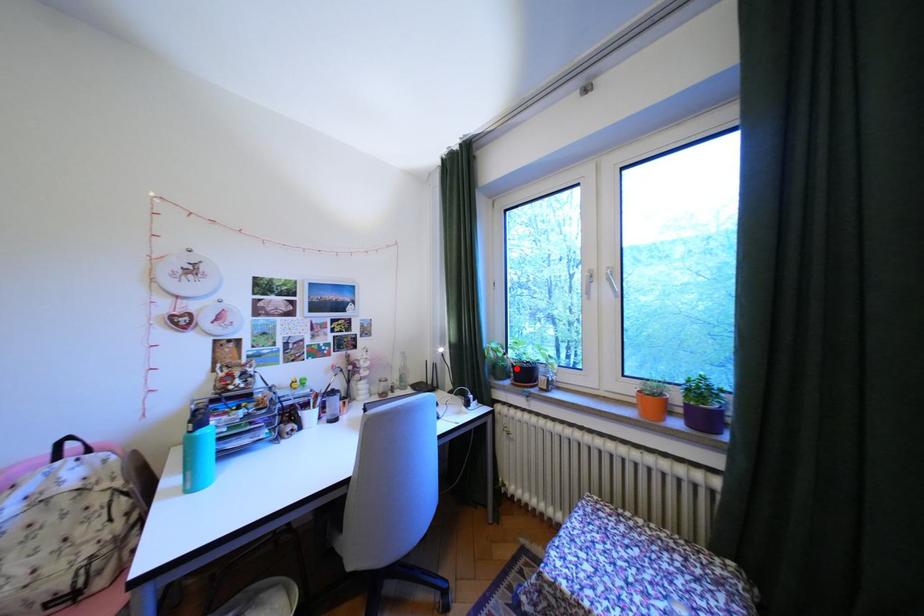
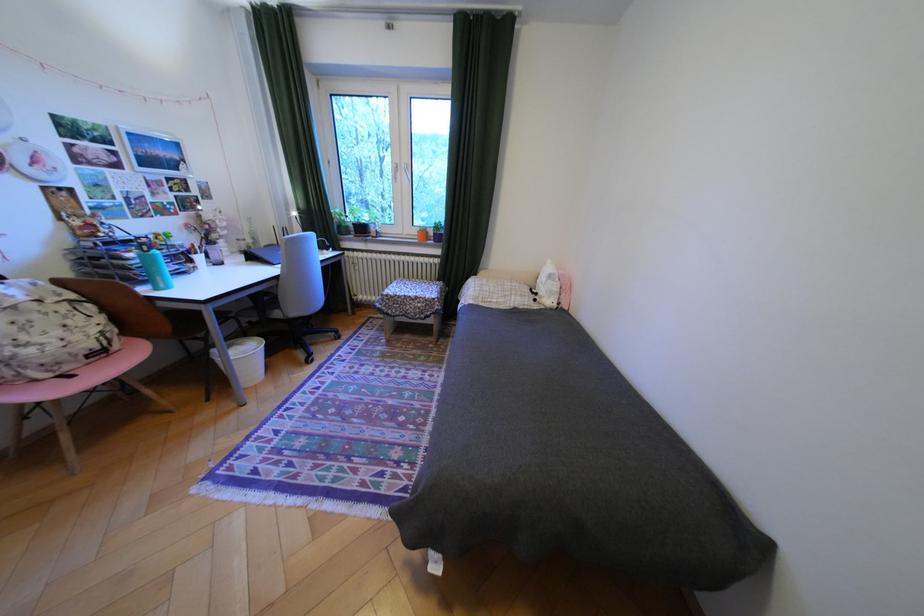
Question: I am providing you with two images of the same scene from different viewpoints. In image1, a red point is highlighted. Considering the same 3D point in image2, which of the following is correct?

Choices:
 (A) It is closer
 (B) It is farther

Answer: (A)